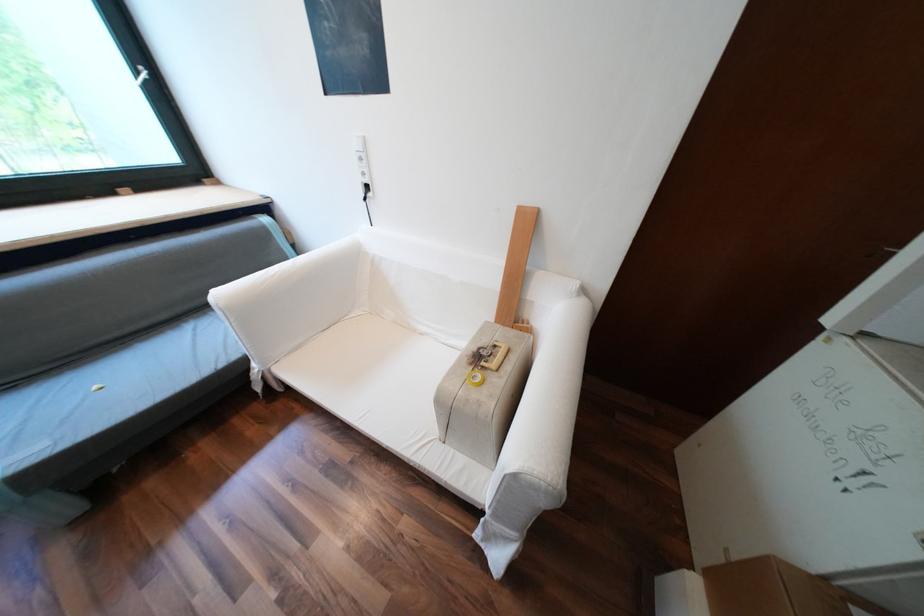
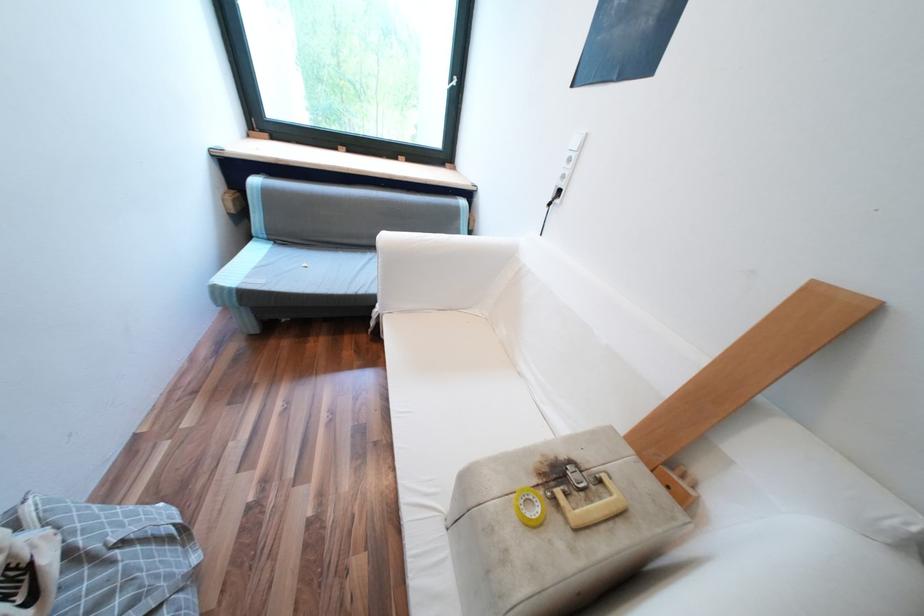
Question: The camera is either moving clockwise (left) or counter-clockwise (right) around the object. The first image is from the beginning of the video and the second image is from the end. Is the camera moving left or right when shooting the video?

Choices:
 (A) Left
 (B) Right

Answer: (B)